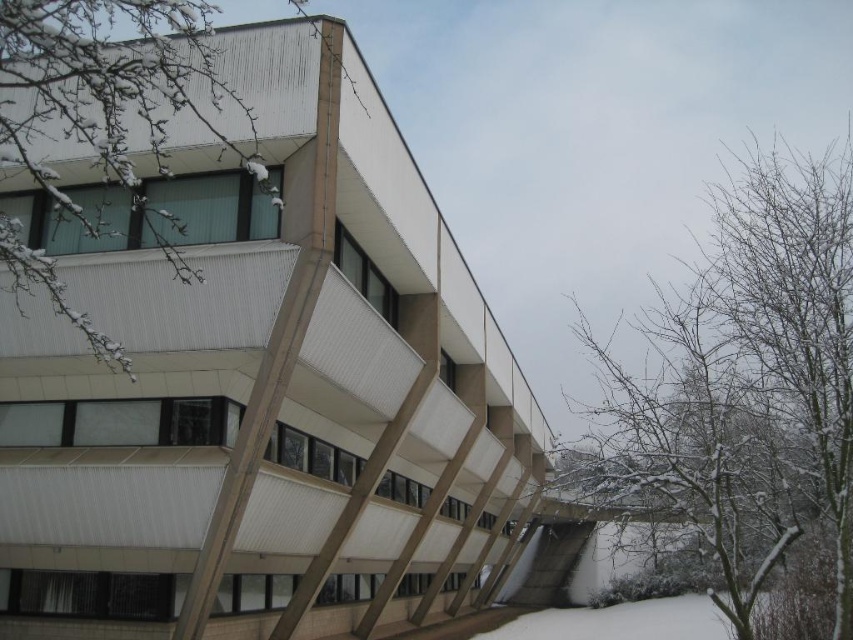
Question: Can you confirm if snow-covered branches at upper right is positioned to the right of snow-covered branches at upper left?

Choices:
 (A) yes
 (B) no

Answer: (A)

Question: Observing the image, what is the correct spatial positioning of snow-covered branches at upper right in reference to snow-covered branches at upper left?

Choices:
 (A) left
 (B) right

Answer: (B)

Question: Among these objects, which one is nearest to the camera?

Choices:
 (A) snow-covered branches at upper left
 (B) snow-covered branches at upper right

Answer: (A)

Question: Can you confirm if snow-covered branches at upper right is bigger than snow-covered branches at upper left?

Choices:
 (A) no
 (B) yes

Answer: (B)

Question: Which of the following is the farthest from the observer?

Choices:
 (A) snow-covered branches at upper right
 (B) snow-covered branches at upper left

Answer: (A)